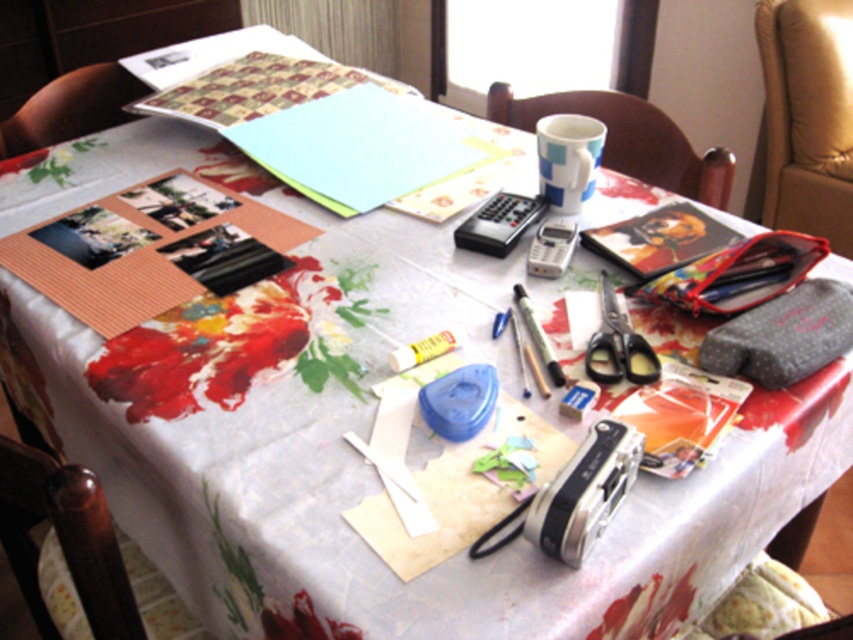
Question: Which of the following is the farthest from the observer?

Choices:
 (A) (723, 164)
 (B) (776, 195)

Answer: (B)

Question: In this image, where is leather at right located relative to yellow matte glue stick at center?

Choices:
 (A) left
 (B) right

Answer: (B)

Question: Is silver metallic phone at center positioned in front of metallic silver pen at center?

Choices:
 (A) no
 (B) yes

Answer: (A)

Question: Among these points, which one is nearest to the camera?

Choices:
 (A) (32, 109)
 (B) (828, 129)

Answer: (A)

Question: Is wooden chair at upper center behind silver metallic phone at center?

Choices:
 (A) yes
 (B) no

Answer: (A)

Question: Based on their relative distances, which object is nearer to the leather at right?

Choices:
 (A) brown wood chair at lower left
 (B) silver metallic phone at center
 (C) blue and white ceramic mug at upper center

Answer: (C)